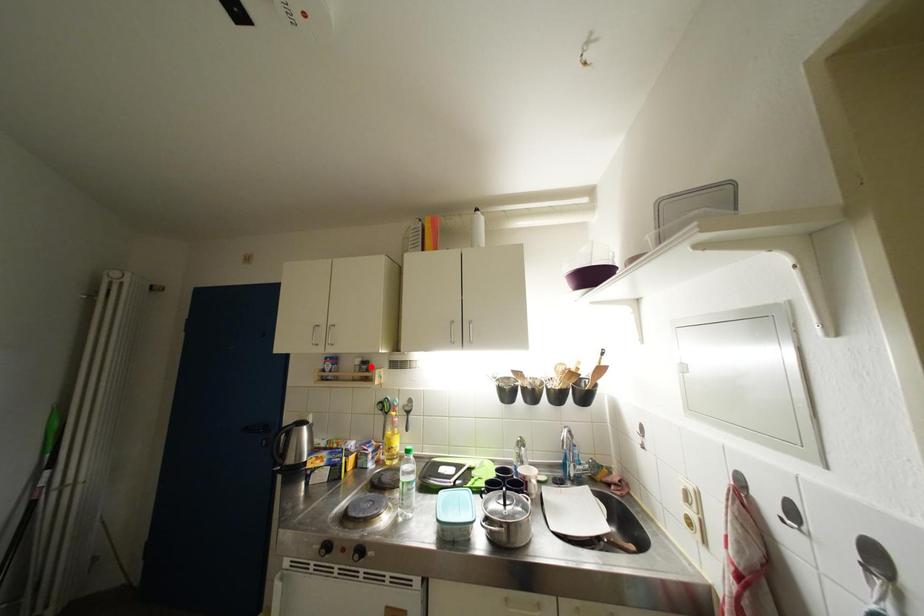
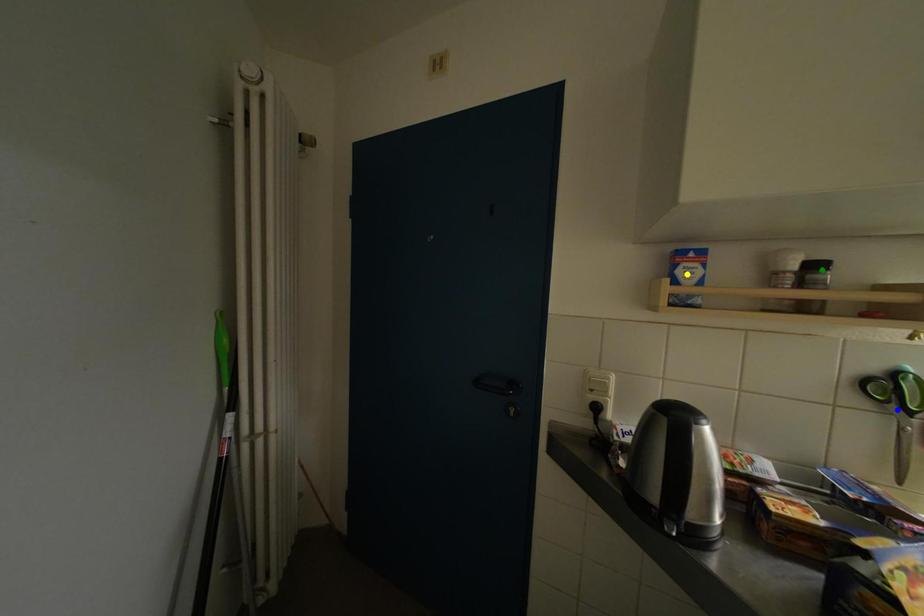
Question: I am providing you with two images of the same scene from different viewpoints. A red point is marked on the first image. You are given multiple points on the second image. Which mark in image 2 goes with the point in image 1?

Choices:
 (A) green point
 (B) blue point
 (C) yellow point

Answer: (A)